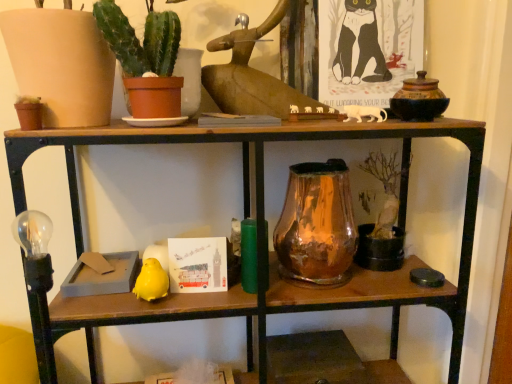
Question: From a real-world perspective, is amber glass vase at center on top of yellow matte bird at lower left?

Choices:
 (A) yes
 (B) no

Answer: (A)

Question: Is amber glass vase at center wider than yellow matte bird at lower left?

Choices:
 (A) yes
 (B) no

Answer: (A)

Question: Is amber glass vase at center looking in the opposite direction of yellow matte bird at lower left?

Choices:
 (A) no
 (B) yes

Answer: (A)

Question: Is amber glass vase at center shorter than yellow matte bird at lower left?

Choices:
 (A) yes
 (B) no

Answer: (B)

Question: From a real-world perspective, is amber glass vase at center physically below yellow matte bird at lower left?

Choices:
 (A) no
 (B) yes

Answer: (A)

Question: Does amber glass vase at center appear on the right side of yellow matte bird at lower left?

Choices:
 (A) yes
 (B) no

Answer: (A)

Question: Can you confirm if yellow matte bird at lower left is shorter than green matte cactus at upper left?

Choices:
 (A) no
 (B) yes

Answer: (B)

Question: From a real-world perspective, is yellow matte bird at lower left below green matte cactus at upper left?

Choices:
 (A) no
 (B) yes

Answer: (B)

Question: From the image's perspective, does yellow matte bird at lower left appear lower than green matte cactus at upper left?

Choices:
 (A) no
 (B) yes

Answer: (B)

Question: Are yellow matte bird at lower left and green matte cactus at upper left located far from each other?

Choices:
 (A) yes
 (B) no

Answer: (B)

Question: From the image's perspective, does yellow matte bird at lower left appear higher than green matte cactus at upper left?

Choices:
 (A) yes
 (B) no

Answer: (B)

Question: Is yellow matte bird at lower left to the right of green matte cactus at upper left from the viewer's perspective?

Choices:
 (A) no
 (B) yes

Answer: (A)

Question: Is yellow matte bird at lower left facing away from amber glass vase at center?

Choices:
 (A) no
 (B) yes

Answer: (A)